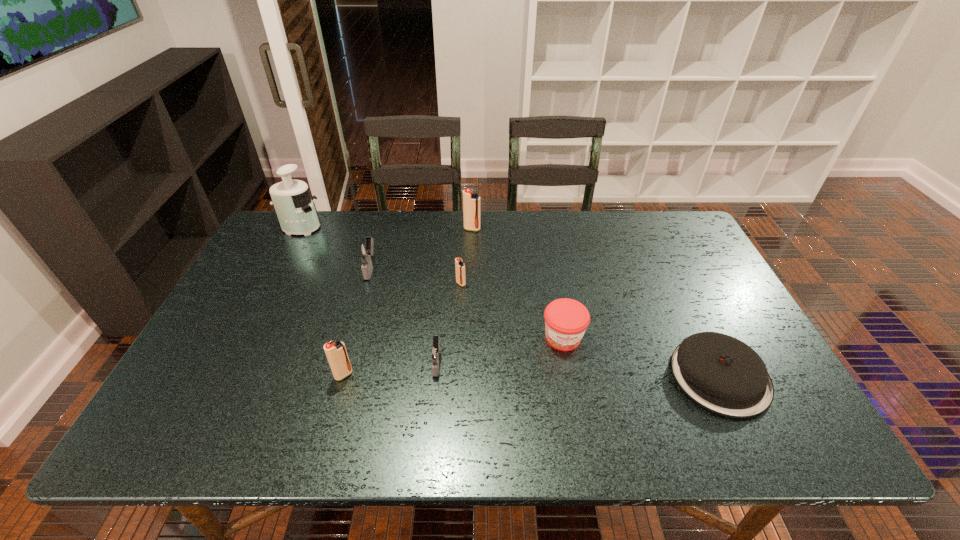
What are the coordinates of `the tallest object` in the screenshot? It's located at (294, 207).

At what (x,y) coordinates should I click in order to perform the action: click on juicer. Please return your answer as a coordinate pair (x, y). Image resolution: width=960 pixels, height=540 pixels. Looking at the image, I should click on (294, 207).

This screenshot has width=960, height=540. In order to click on the seventh shortest object in this screenshot , I will do [x=471, y=202].

This screenshot has height=540, width=960. I want to click on the biggest red igniter, so click(x=471, y=202).

The width and height of the screenshot is (960, 540). I want to click on the bigger gray igniter, so click(364, 250).

Find the location of a particular element. The height and width of the screenshot is (540, 960). the farther gray igniter is located at coordinates (364, 250).

At what (x,y) coordinates should I click in order to perform the action: click on the second smallest red igniter. Please return your answer as a coordinate pair (x, y). The width and height of the screenshot is (960, 540). Looking at the image, I should click on (336, 353).

Find the location of a particular element. This screenshot has height=540, width=960. the leftmost red igniter is located at coordinates (336, 353).

Find the location of `jam`. jam is located at coordinates (566, 320).

Find the location of a particular element. The image size is (960, 540). the second object from right to left is located at coordinates (566, 320).